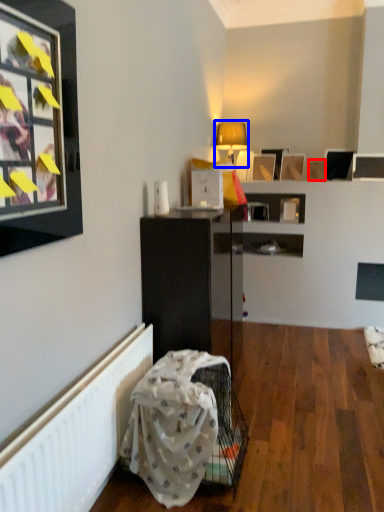
Question: Which object is closer to the camera taking this photo, picture frame (highlighted by a red box) or table lamp (highlighted by a blue box)?

Choices:
 (A) picture frame
 (B) table lamp

Answer: (B)